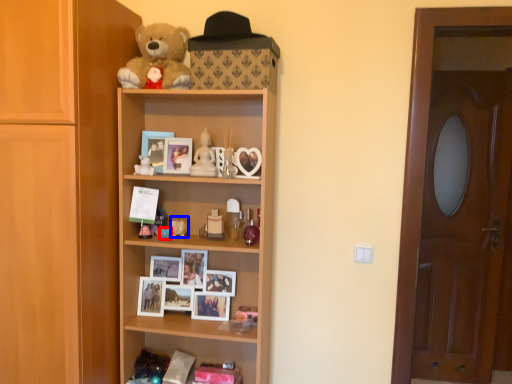
Question: Among these objects, which one is farthest to the camera, toy (highlighted by a red box) or toy (highlighted by a blue box)?

Choices:
 (A) toy
 (B) toy

Answer: (B)